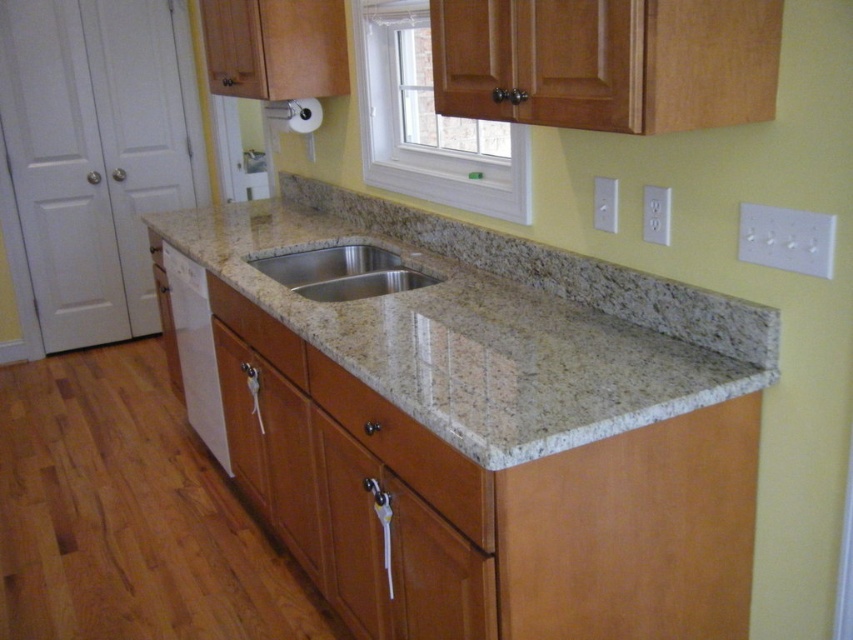
Consider the image. You are standing in front of the kitchen and need to place a cutting board on the granite countertop at center and the stainless steel sink at center. Which object should you place it on if you want it to the right of the sink?

You should place the cutting board on the granite countertop at center because it is to the left of the stainless steel sink at center, so the countertop is on the right side of the sink.

You are standing in the kitchen and need to reach both the wooden drawer at center and the stainless steel sink at center. Which one is closer to you?

The wooden drawer at center is closer to the viewer than the stainless steel sink at center.

You are a delivery person placing a package on the kitchen countertop. You need to place it between the two points marked as point (347, 401) and point (283, 256). Since you want the package to be closer to the wall, which point should you use as the reference?

Point (347, 401) is in front of point (283, 256). To place the package closer to the wall, you should use point (283, 256) as the reference because it is closer to the wall.